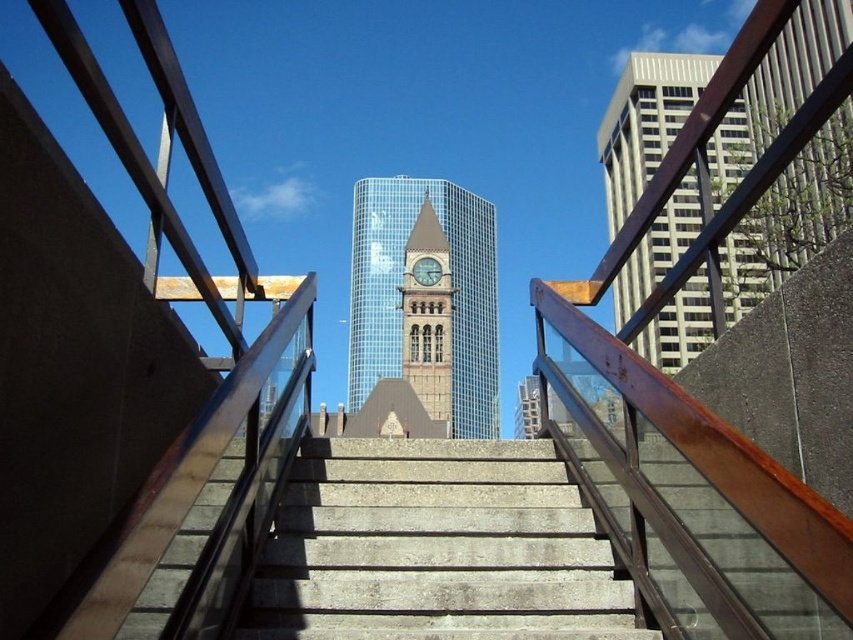
Question: Which point is closer to the camera taking this photo?

Choices:
 (A) (758, 300)
 (B) (422, 275)
 (C) (416, 612)

Answer: (C)

Question: Which of these objects is positioned closest to the glassy steel clock tower at center?

Choices:
 (A) concrete stairs at center
 (B) gold textured clock at center

Answer: (B)

Question: Does concrete stairs at center appear on the right side of gold textured clock at center?

Choices:
 (A) no
 (B) yes

Answer: (B)

Question: Observing the image, what is the correct spatial positioning of glassy steel clock tower at center in reference to gold textured clock at center?

Choices:
 (A) below
 (B) above

Answer: (A)

Question: Is concrete stairs at center wider than glassy steel clock tower at center?

Choices:
 (A) yes
 (B) no

Answer: (B)

Question: Among these objects, which one is nearest to the camera?

Choices:
 (A) glassy steel clock tower at center
 (B) concrete stairs at center
 (C) brown stone clock tower at center

Answer: (B)